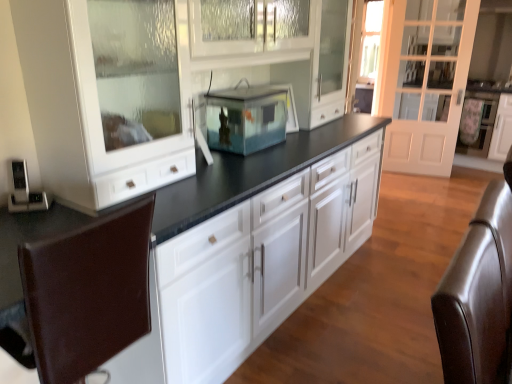
Identify the location of vacant space in front of matte black speaker at left, the 2th appliance from the back. (22, 226).